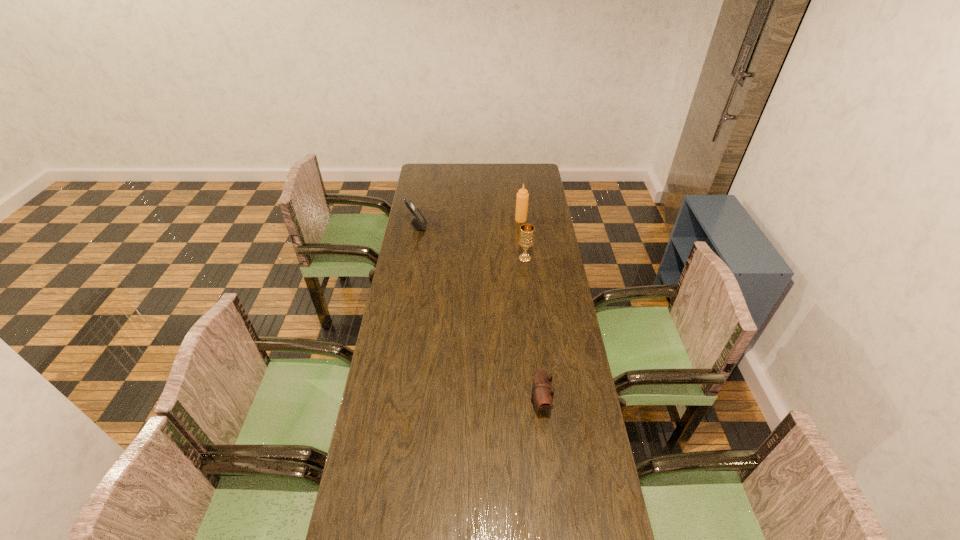
Identify the location of the tallest object. (522, 198).

Locate an element on the screen. The height and width of the screenshot is (540, 960). cellular telephone is located at coordinates (418, 221).

At what (x,y) coordinates should I click in order to perform the action: click on the third farthest object. Please return your answer as a coordinate pair (x, y). Looking at the image, I should click on (526, 238).

The height and width of the screenshot is (540, 960). I want to click on pouch, so click(542, 391).

Find the location of a particular element. The height and width of the screenshot is (540, 960). the shortest object is located at coordinates (542, 391).

Identify the location of vacant region located 0.130m on the back of the tallest object. (519, 202).

Find the location of a particular element. Image resolution: width=960 pixels, height=540 pixels. free space located 0.280m on the front-facing side of the leftmost object is located at coordinates (483, 227).

This screenshot has height=540, width=960. I want to click on vacant area situated 0.190m on the back of the chalice, so click(521, 229).

Identify the location of vacant space located with the flap open on the shortest object. The height and width of the screenshot is (540, 960). (461, 402).

Locate an element on the screen. vacant space positioned 0.060m with the flap open on the shortest object is located at coordinates 512,402.